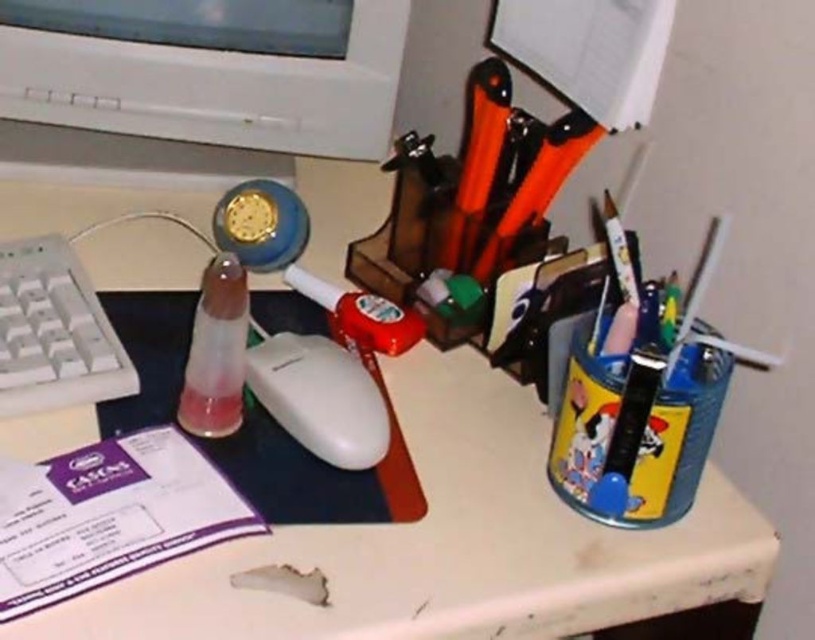
Looking at this image, does white plastic monitor at upper left appear on the left side of white matte mouse at center?

Indeed, white plastic monitor at upper left is positioned on the left side of white matte mouse at center.

This screenshot has width=815, height=640. Describe the element at coordinates (209, 68) in the screenshot. I see `white plastic monitor at upper left` at that location.

Identify the location of white plastic monitor at upper left. (209, 68).

Is white plastic monitor at upper left wider than translucent plastic pen at center?

Yes.

At what (x,y) coordinates should I click in order to perform the action: click on white plastic monitor at upper left. Please return your answer as a coordinate pair (x, y). The width and height of the screenshot is (815, 640). Looking at the image, I should click on (209, 68).

Which is behind, point (364, 118) or point (222, 321)?

The point (364, 118) is behind.

Find the location of `white plastic monitor at upper left`. white plastic monitor at upper left is located at coordinates (209, 68).

Which is above, white matte keyboard at left or translucent plastic pen at center?

translucent plastic pen at center is above.

Can you confirm if white matte keyboard at left is positioned to the left of translucent plastic pen at center?

Indeed, white matte keyboard at left is positioned on the left side of translucent plastic pen at center.

Measure the distance between white matte keyboard at left and camera.

They are 22.24 inches apart.

Locate an element on the screen. Image resolution: width=815 pixels, height=640 pixels. white matte keyboard at left is located at coordinates (54, 332).